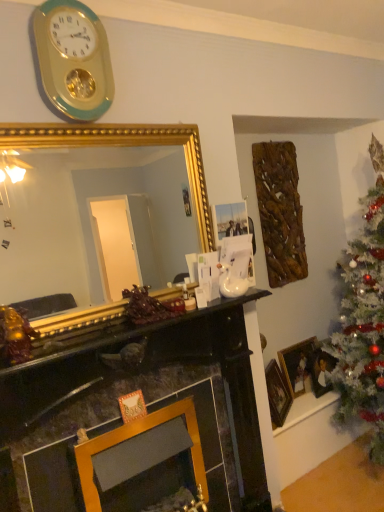
Question: Does point (273, 394) appear closer or farther from the camera than point (306, 364)?

Choices:
 (A) closer
 (B) farther

Answer: (A)

Question: From the image's perspective, is gold-framed picture at right, the first picture frame from the front, above or below wooden picture frame at lower right, which ranks as the 2th picture frame in back-to-front order?

Choices:
 (A) above
 (B) below

Answer: (B)

Question: Which of these objects is positioned farthest from the wooden picture frame at lower right, which ranks as the 2th picture frame in back-to-front order?

Choices:
 (A) white matte christmas tree at right
 (B) gold/gilded mirror at center
 (C) gold-framed picture at right, the first picture frame from the front
 (D) gold/green plastic wall clock at upper left
 (E) wooden picture frame at right, marked as the third picture frame in a front-to-back arrangement

Answer: (B)

Question: Which of these objects is positioned farthest from the gold/green plastic wall clock at upper left?

Choices:
 (A) white matte christmas tree at right
 (B) gold-framed picture at right, the first picture frame from the front
 (C) gold/gilded mirror at center
 (D) wooden picture frame at right, the first picture frame viewed from the back
 (E) wooden picture frame at lower right, which appears as the second picture frame when viewed from the front

Answer: (C)